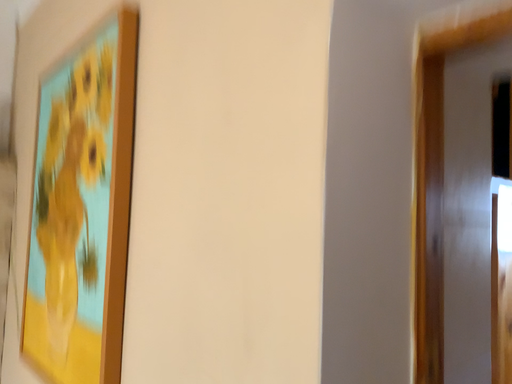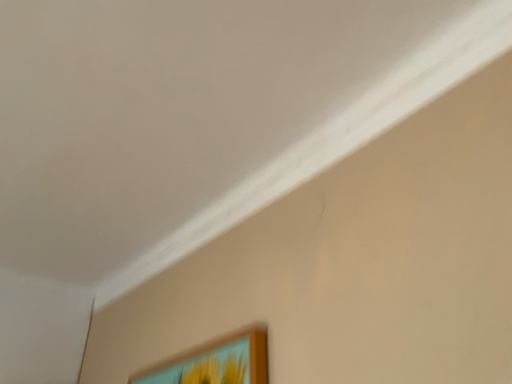
Question: Which way did the camera rotate in the video?

Choices:
 (A) rotated upward
 (B) rotated downward

Answer: (A)